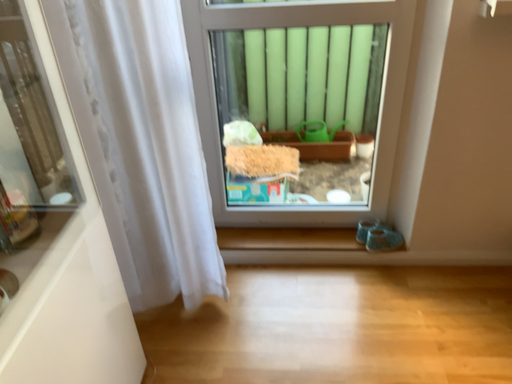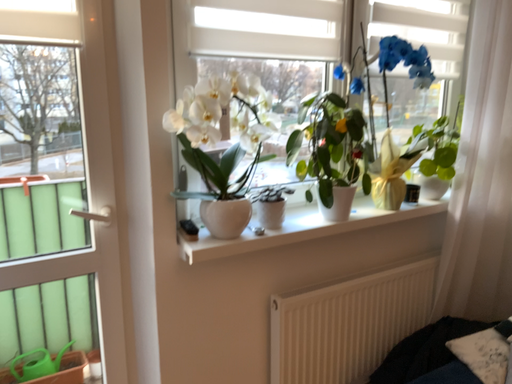
Question: How did the camera likely rotate when shooting the video?

Choices:
 (A) rotated left
 (B) rotated right

Answer: (B)